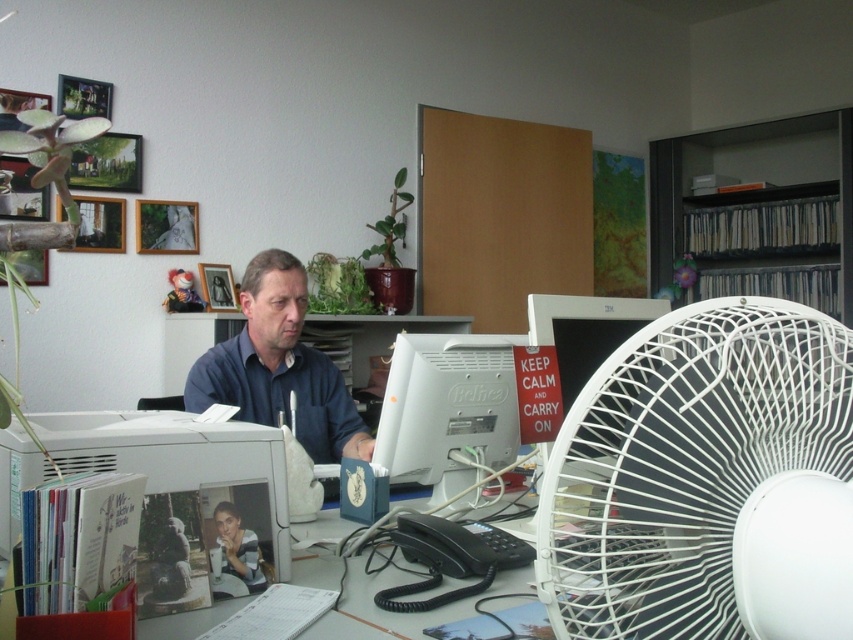
Question: Which object appears closest to the camera in this image?

Choices:
 (A) white plastic fan at right
 (B) white plastic monitor at center
 (C) white glossy monitor at center right

Answer: (A)

Question: Can you confirm if white plastic monitor at center is positioned to the left of dark blue shirt at center?

Choices:
 (A) no
 (B) yes

Answer: (A)

Question: Which point is farther from the camera taking this photo?

Choices:
 (A) (457, 371)
 (B) (256, 330)
 (C) (598, 609)

Answer: (B)

Question: Is white plastic fan at right to the right of dark blue shirt at center from the viewer's perspective?

Choices:
 (A) no
 (B) yes

Answer: (B)

Question: In this image, where is white plastic fan at right located relative to white glossy monitor at center right?

Choices:
 (A) below
 (B) above

Answer: (A)

Question: Which of the following is the closest to the observer?

Choices:
 (A) white glossy monitor at center right
 (B) dark blue shirt at center

Answer: (A)